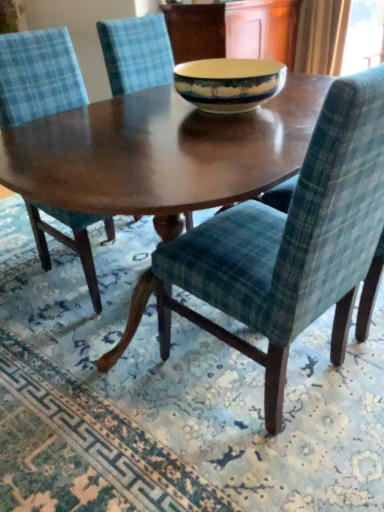
Question: In which direction should I rotate to look at velvet blue chair at center, which ranks as the 2th chair in left-to-right order?

Choices:
 (A) left
 (B) right

Answer: (A)

Question: From the image's perspective, is green plaid fabric at lower right located beneath velvet green chair at center, which appears as the 1th chair when viewed from the right?

Choices:
 (A) no
 (B) yes

Answer: (B)

Question: Is velvet green chair at center, which appears as the 1th chair when viewed from the right, completely or partially inside green plaid fabric at lower right?

Choices:
 (A) no
 (B) yes

Answer: (A)

Question: Is velvet green chair at center, which appears as the 1th chair when viewed from the right, at the back of green plaid fabric at lower right?

Choices:
 (A) yes
 (B) no

Answer: (B)

Question: Is green plaid fabric at lower right behind velvet green chair at center, which appears as the 1th chair when viewed from the right?

Choices:
 (A) yes
 (B) no

Answer: (A)

Question: Can you confirm if green plaid fabric at lower right is thinner than velvet green chair at center, which is the third chair from left to right?

Choices:
 (A) no
 (B) yes

Answer: (A)

Question: Is green plaid fabric at lower right directly adjacent to velvet green chair at center, which is the third chair from left to right?

Choices:
 (A) yes
 (B) no

Answer: (B)

Question: Does velvet blue chair at center, which ranks as the 2th chair in right-to-left order, turn towards velvet blue chair at center, which ranks as the 3th chair in right-to-left order?

Choices:
 (A) yes
 (B) no

Answer: (B)

Question: Is velvet blue chair at center, which ranks as the 2th chair in left-to-right order, facing away from velvet blue chair at center, which ranks as the 3th chair in right-to-left order?

Choices:
 (A) yes
 (B) no

Answer: (B)

Question: From a real-world perspective, is velvet blue chair at center, which ranks as the 2th chair in right-to-left order, on top of velvet blue chair at center, which ranks as the 3th chair in right-to-left order?

Choices:
 (A) no
 (B) yes

Answer: (B)

Question: Is velvet blue chair at center, which ranks as the 2th chair in right-to-left order, wider than velvet blue chair at center, which ranks as the first chair in left-to-right order?

Choices:
 (A) yes
 (B) no

Answer: (A)

Question: Does velvet blue chair at center, which ranks as the 2th chair in left-to-right order, have a greater height compared to velvet blue chair at center, which ranks as the 3th chair in right-to-left order?

Choices:
 (A) no
 (B) yes

Answer: (A)

Question: Is velvet blue chair at center, which ranks as the 2th chair in right-to-left order, positioned in front of velvet blue chair at center, which ranks as the 3th chair in right-to-left order?

Choices:
 (A) yes
 (B) no

Answer: (B)

Question: Is velvet blue chair at center, which ranks as the 3th chair in right-to-left order, wider than matte ceramic bowl at center?

Choices:
 (A) no
 (B) yes

Answer: (B)